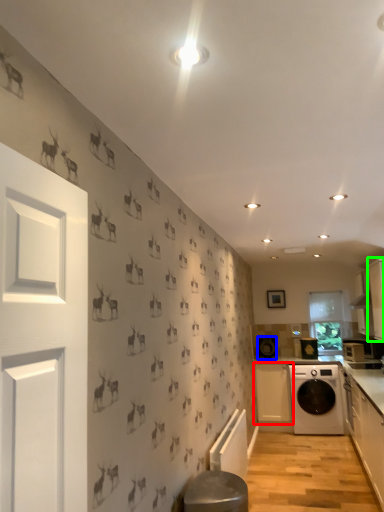
Question: Which object is positioned farthest from cabinetry (highlighted by a red box)? Select from appliance (highlighted by a blue box) and cabinetry (highlighted by a green box).

Choices:
 (A) appliance
 (B) cabinetry

Answer: (B)